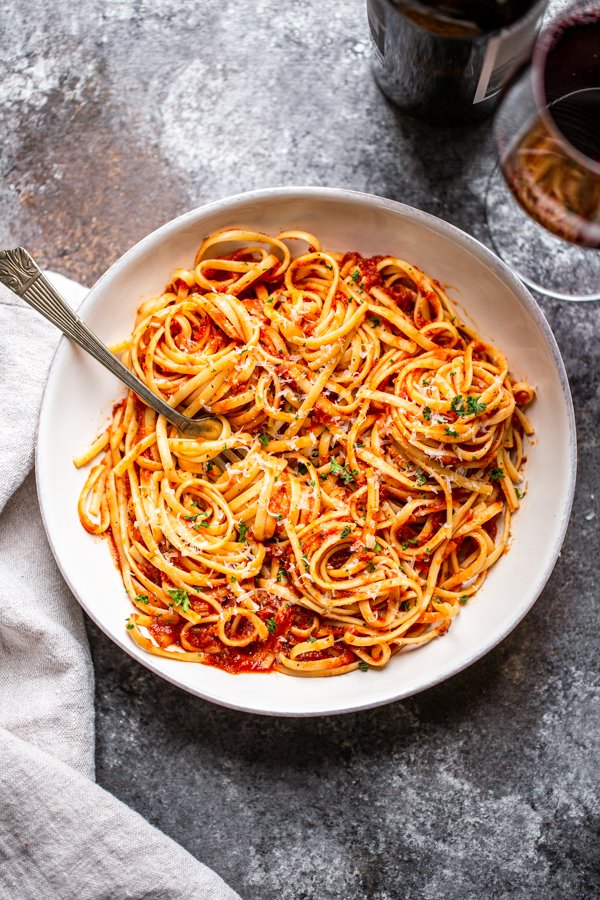
Image resolution: width=600 pixels, height=900 pixels. I want to click on glass, so click(518, 203).